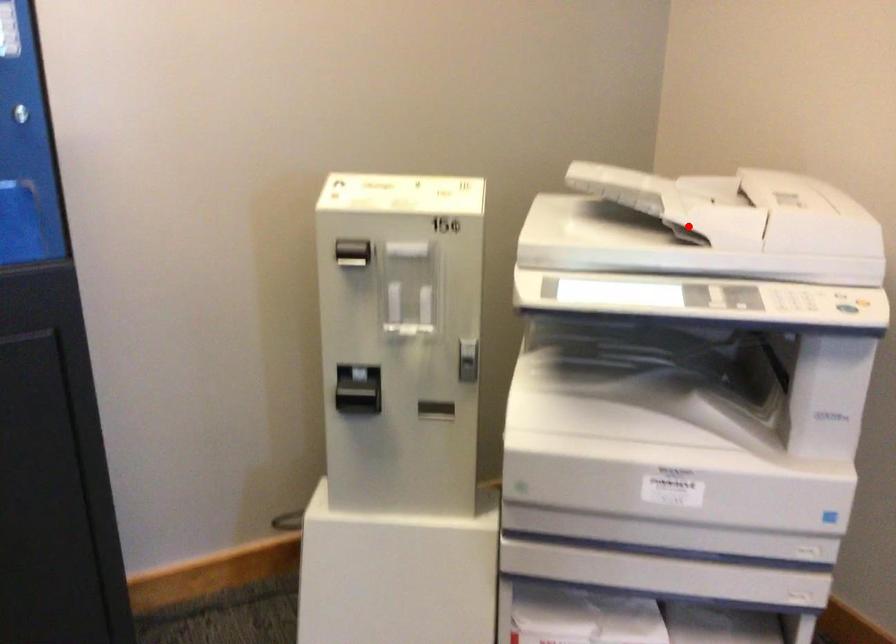
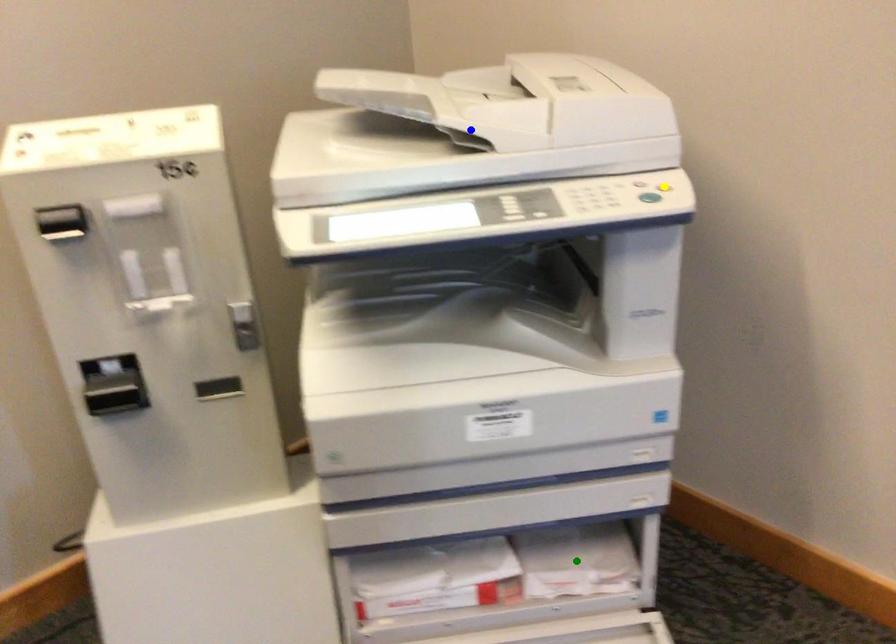
Question: I am providing you with two images of the same scene from different viewpoints. A red point is marked on the first image. You are given multiple points on the second image. Which point in image 2 represents the same 3d spot as the red point in image 1?

Choices:
 (A) green point
 (B) yellow point
 (C) blue point

Answer: (C)